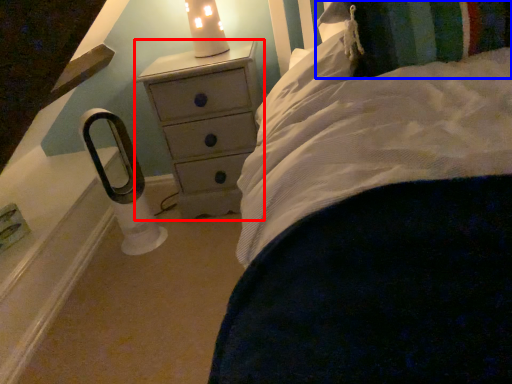
Question: Which of the following is the closest to the observer, chest of drawers (highlighted by a red box) or pillow (highlighted by a blue box)?

Choices:
 (A) chest of drawers
 (B) pillow

Answer: (B)